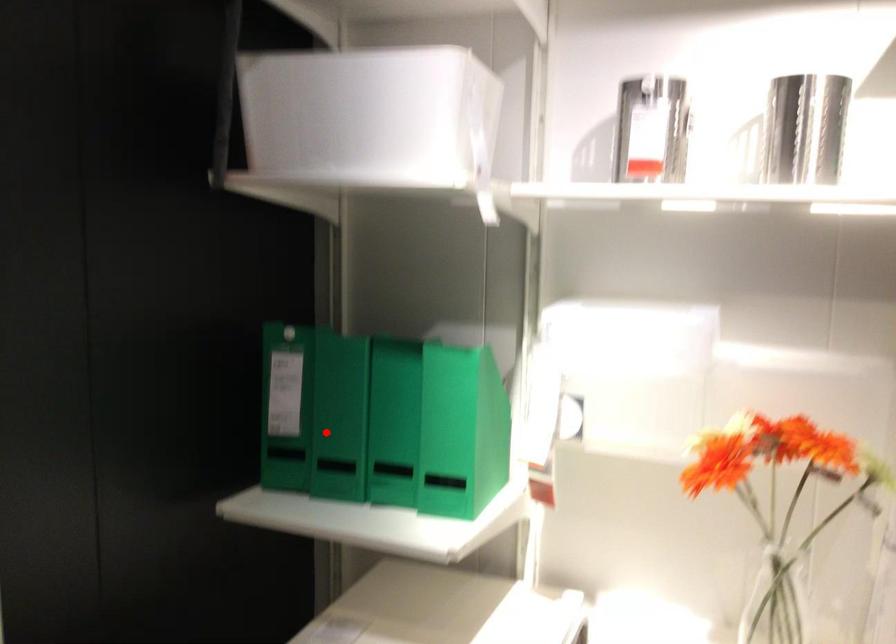
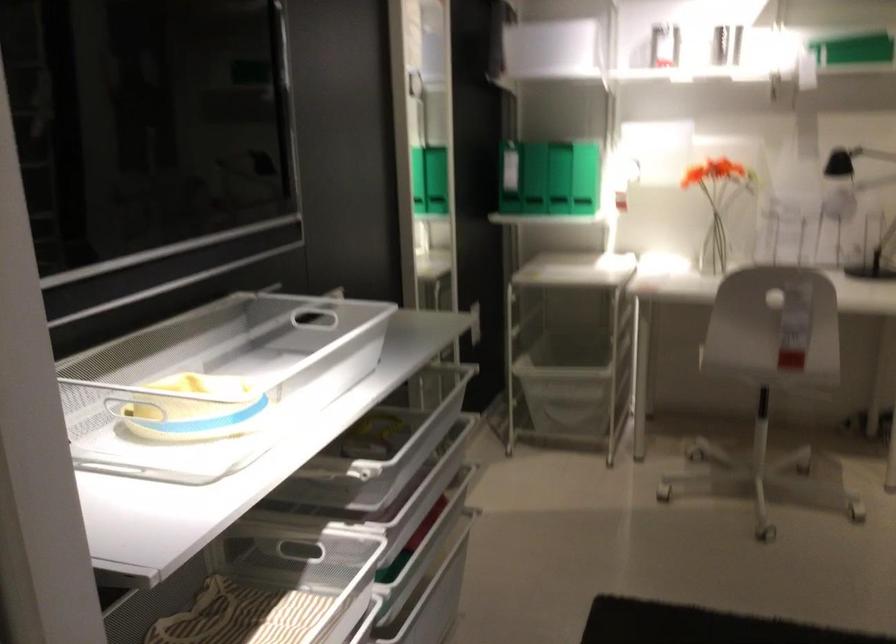
Question: I am providing you with two images of the same scene from different viewpoints. Given a red point in image1, look at the same physical point in image2. Is it:

Choices:
 (A) Closer to the viewpoint
 (B) Farther from the viewpoint

Answer: (B)